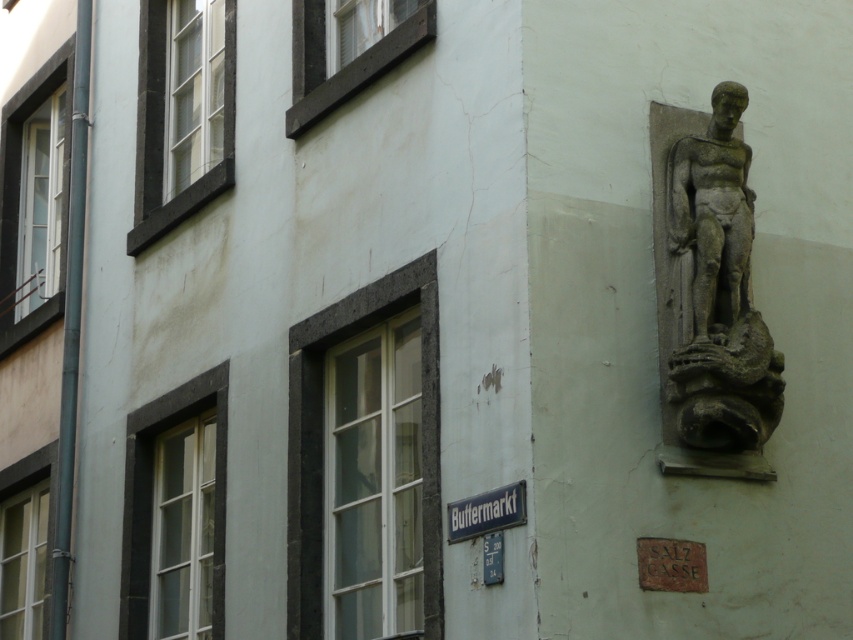
Question: Does gray stone statue at upper right have a smaller size compared to metallic blue street sign at center?

Choices:
 (A) no
 (B) yes

Answer: (A)

Question: From the image, what is the correct spatial relationship of gray stone statue at upper right in relation to metallic blue street sign at center?

Choices:
 (A) above
 (B) below

Answer: (A)

Question: Can you confirm if gray stone statue at upper right is wider than metallic blue street sign at center?

Choices:
 (A) yes
 (B) no

Answer: (A)

Question: Which of the following is the closest to the observer?

Choices:
 (A) gray stone statue at upper right
 (B) metallic blue street sign at center

Answer: (B)

Question: Which of the following is the closest to the observer?

Choices:
 (A) (675, 324)
 (B) (448, 538)

Answer: (B)